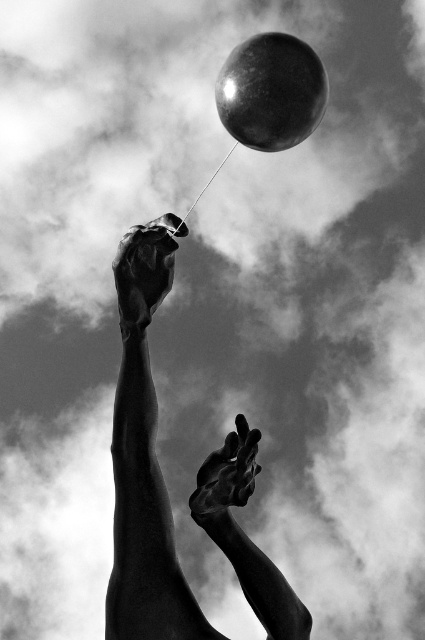
Based on the scene described, which hand has a greater width between the polished bronze hand at upper center and the shiny metallic hand at center?

The polished bronze hand at upper center has a greater width compared to the shiny metallic hand at center.

You are a photographer standing at the camera position in the image. You want to take a closeup shot of the glossy metallic balloon at upper center. The camera lens has a focal length of 50mm. What is the minimum distance you need to move the camera backward to focus on the balloon?

The glossy metallic balloon at upper center is 5.08 meters away from the camera. To focus on it with a 50mm lens, the minimum distance to move backward is negligible since the balloon is already within the lens focusing range. However, if focusing requires the subject to be at least 1 meter away, no adjustment is needed as it is already 5.08 meters away.